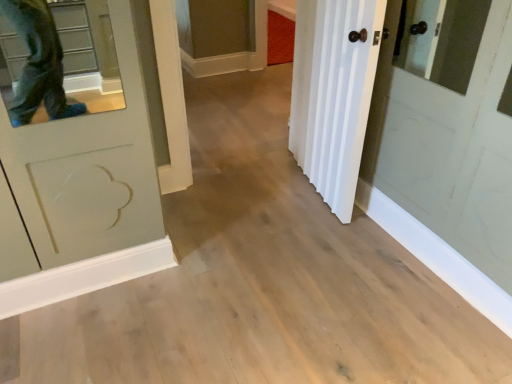
Question: Is white wood door at center shorter than white matte cabinet at upper center?

Choices:
 (A) yes
 (B) no

Answer: (B)

Question: Could you tell me if white wood door at center is turned towards white matte cabinet at upper center?

Choices:
 (A) yes
 (B) no

Answer: (B)

Question: Can you confirm if white wood door at center is thinner than white matte cabinet at upper center?

Choices:
 (A) no
 (B) yes

Answer: (B)

Question: Considering the relative sizes of white wood door at center and white matte cabinet at upper center in the image provided, is white wood door at center bigger than white matte cabinet at upper center?

Choices:
 (A) yes
 (B) no

Answer: (B)

Question: From a real-world perspective, is white wood door at center under white matte cabinet at upper center?

Choices:
 (A) no
 (B) yes

Answer: (A)

Question: Is white wood door at center smaller than white matte cabinet at upper center?

Choices:
 (A) yes
 (B) no

Answer: (A)

Question: From a real-world perspective, does white matte cabinet at upper center stand above white wood door at center?

Choices:
 (A) no
 (B) yes

Answer: (A)

Question: Is white matte cabinet at upper center completely or partially outside of white wood door at center?

Choices:
 (A) yes
 (B) no

Answer: (A)

Question: Does white matte cabinet at upper center have a greater height compared to white wood door at center?

Choices:
 (A) no
 (B) yes

Answer: (A)

Question: Is white matte cabinet at upper center smaller than white wood door at center?

Choices:
 (A) yes
 (B) no

Answer: (B)

Question: Could you tell me if white matte cabinet at upper center is facing white wood door at center?

Choices:
 (A) yes
 (B) no

Answer: (B)

Question: From a real-world perspective, is white matte cabinet at upper center positioned under white wood door at center based on gravity?

Choices:
 (A) yes
 (B) no

Answer: (A)

Question: Is white matte cabinet at upper center wider or thinner than white wood door at center?

Choices:
 (A) wide
 (B) thin

Answer: (A)